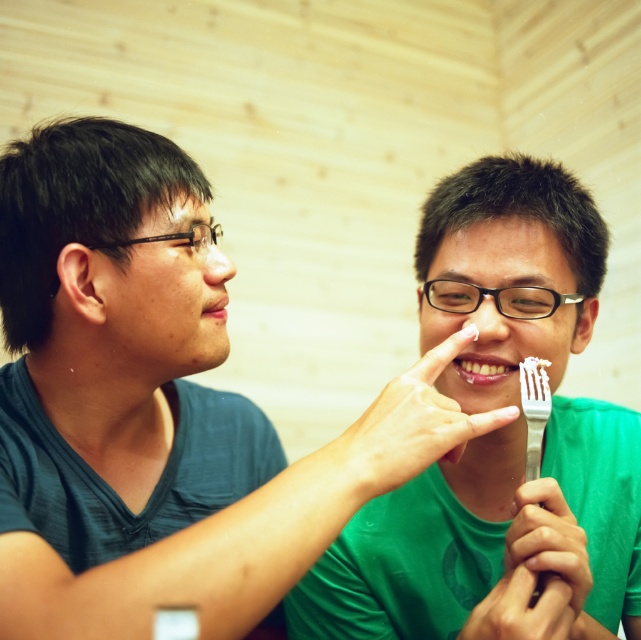
Question: Which point appears farthest from the camera in this image?

Choices:
 (A) (438, 445)
 (B) (494, 364)
 (C) (528, 579)
 (D) (528, 531)

Answer: (B)

Question: Can you confirm if smooth skin hand at center is smaller than matte skin at lower left?

Choices:
 (A) no
 (B) yes

Answer: (A)

Question: Which object is the closest to the white matte fork at center?

Choices:
 (A) silver metallic fork at right
 (B) smooth skin hand at center
 (C) metallic silver fork at center
 (D) matte skin at lower left

Answer: (A)

Question: In this image, where is white matte fork at center located relative to metallic silver fork at center?

Choices:
 (A) above
 (B) below

Answer: (A)

Question: Which of the following is the farthest from the observer?

Choices:
 (A) (535, 474)
 (B) (572, 612)
 (C) (469, 371)

Answer: (C)

Question: Does white matte fork at center appear under smooth skin hand at center?

Choices:
 (A) no
 (B) yes

Answer: (A)